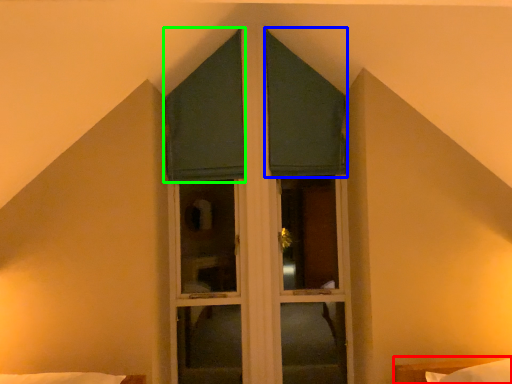
Question: Which object is positioned closest to bed (highlighted by a red box)? Select from curtain (highlighted by a blue box) and curtain (highlighted by a green box).

Choices:
 (A) curtain
 (B) curtain

Answer: (A)